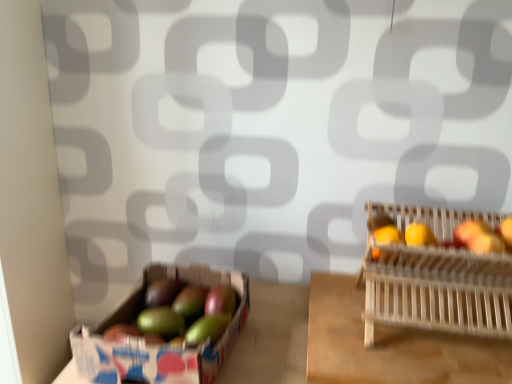
This screenshot has width=512, height=384. I want to click on free space in front of green matte apple at center, which is the 3th apple from right to left, so click(x=244, y=359).